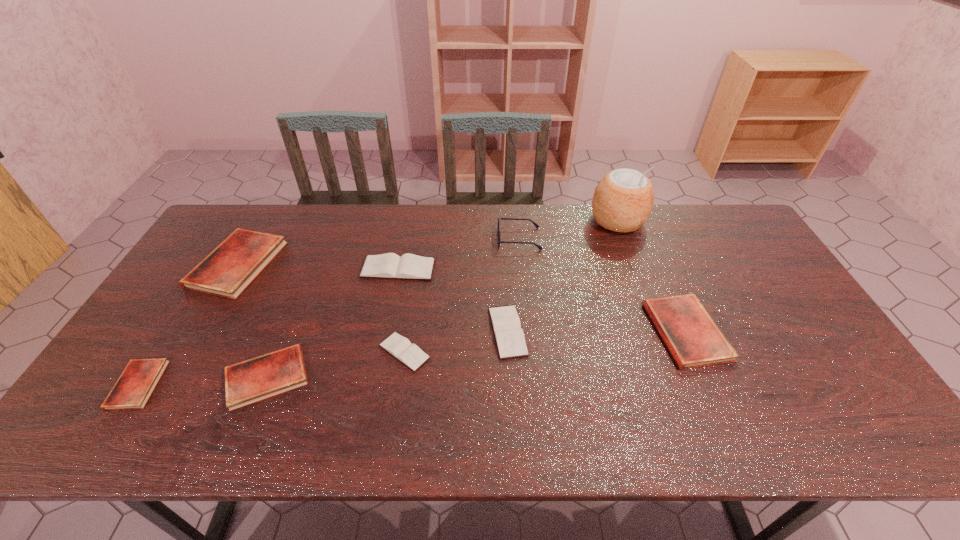
At what (x,y) coordinates should I click in order to perform the action: click on the smallest brown diary. Please return your answer as a coordinate pair (x, y). Looking at the image, I should click on (411, 355).

You are a GUI agent. You are given a task and a screenshot of the screen. Output one action in this format:
    pyautogui.click(x=<x>, y=<y>)
    Task: Click on the smallest red diary
    The height and width of the screenshot is (540, 960).
    Given the screenshot: What is the action you would take?
    pyautogui.click(x=132, y=390)

Locate an element on the screen. The height and width of the screenshot is (540, 960). blank area located 0.060m on the left of the coconut is located at coordinates (572, 221).

The width and height of the screenshot is (960, 540). What are the coordinates of `vacant space located on the front-facing side of the spectacles` in the screenshot? It's located at (444, 239).

The image size is (960, 540). I want to click on vacant space located 0.180m on the front-facing side of the spectacles, so click(444, 239).

Where is `vacant region located on the front-facing side of the spectacles`? This screenshot has width=960, height=540. vacant region located on the front-facing side of the spectacles is located at coordinates (459, 239).

Find the location of a particular element. The width and height of the screenshot is (960, 540). free space located on the front of the biggest red diary is located at coordinates (188, 348).

Identify the location of free region located 0.310m on the right of the biggest brown diary. Image resolution: width=960 pixels, height=540 pixels. (535, 269).

This screenshot has width=960, height=540. I want to click on free region located 0.070m on the left of the rightmost red diary, so click(625, 332).

Locate an element on the screen. blank space located on the right of the sixth diary from left to right is located at coordinates tap(630, 332).